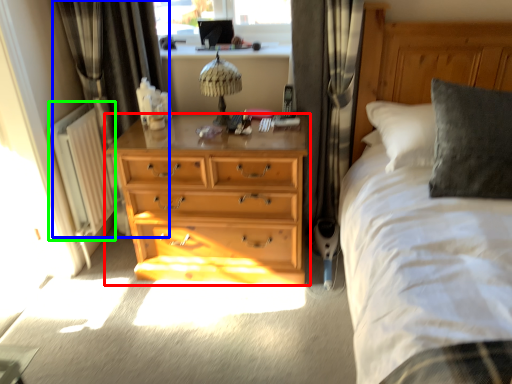
Question: Which is farther away from chest of drawers (highlighted by a red box)? curtain (highlighted by a blue box) or radiator (highlighted by a green box)?

Choices:
 (A) curtain
 (B) radiator

Answer: (A)